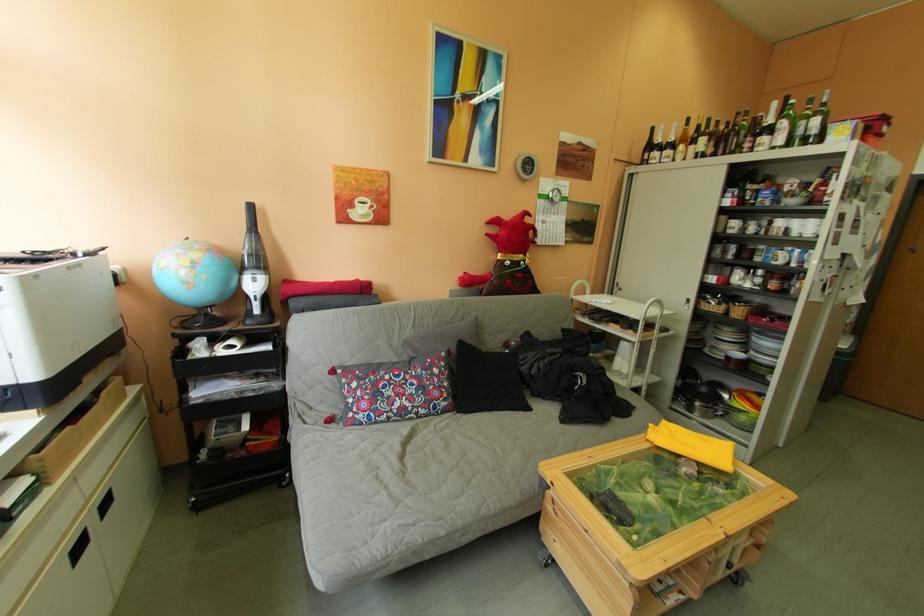
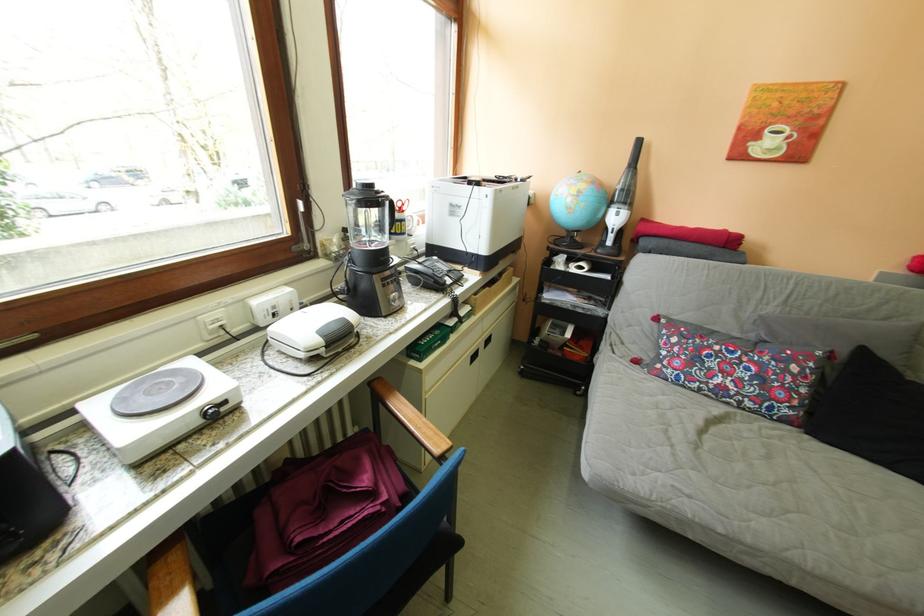
Locate, in the second image, the point that corresponds to (470,416) in the first image.

(821, 437)